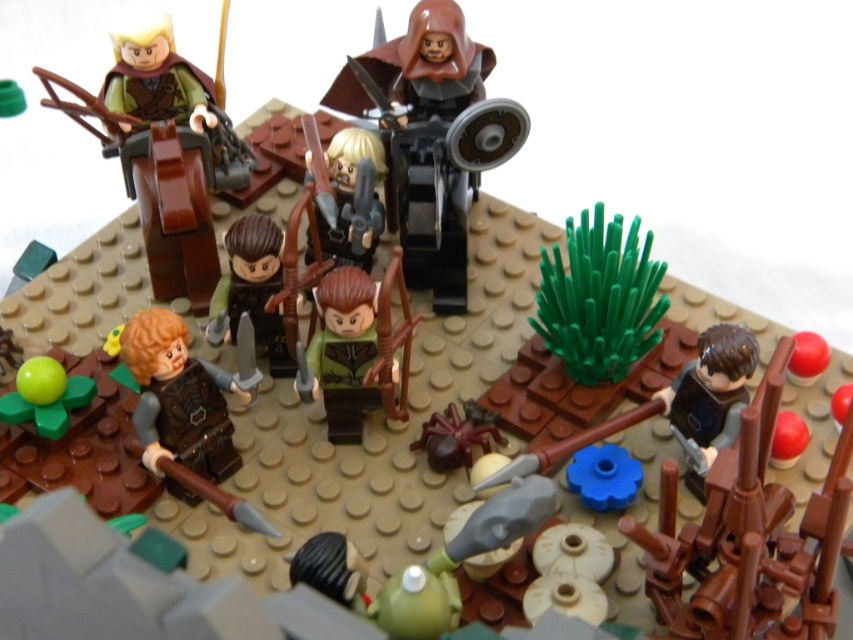
You are a character in the LEGO diorama who needs to pick up either the brown matte sword at lower right or the brown matte helmet at center. Which object is shorter in height?

The brown matte sword at lower right is not as tall as the brown matte helmet at center, so the brown matte sword at lower right is shorter in height.

You are a miniature dragon flying over the LEGO diorama. You want to land on the matte brown horse at upper left without crushing the green matte minifigure at center. Since you know the horse is wider than the minifigure, where should you land to avoid stepping on the minifigure?

The matte brown horse at upper left is wider than the green matte minifigure at center, so you should land on the horse to avoid stepping on the minifigure.